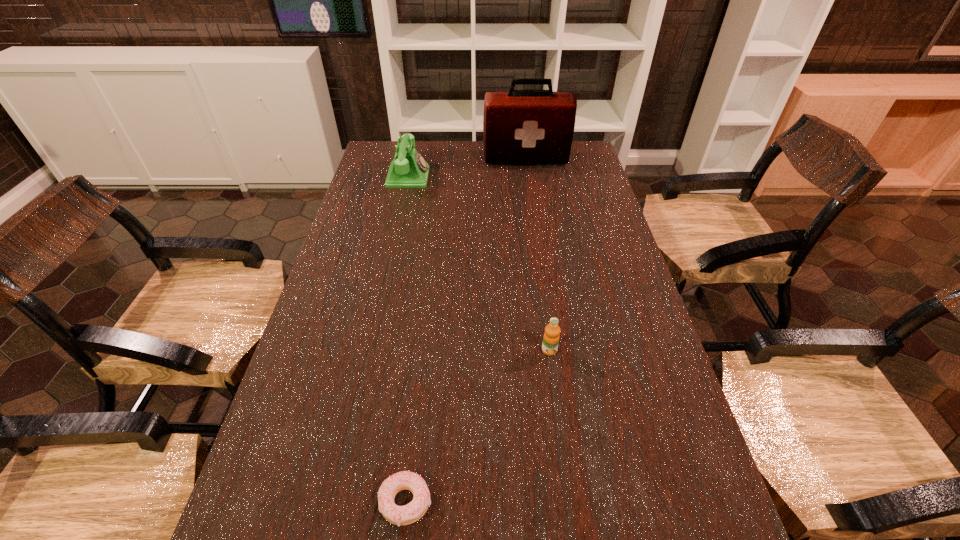
Identify the location of the first aid kit. (519, 126).

Locate an element on the screen. the leftmost object is located at coordinates (408, 169).

This screenshot has height=540, width=960. Find the location of `the second tallest object`. the second tallest object is located at coordinates (408, 169).

Find the location of a particular element. the third tallest object is located at coordinates (551, 336).

The height and width of the screenshot is (540, 960). Identify the location of orange juice. (551, 336).

Find the location of a particular element. the third object from right to left is located at coordinates click(x=404, y=515).

Where is `doughnut`? This screenshot has height=540, width=960. doughnut is located at coordinates (404, 515).

Where is `blank space located on the side of the first aid kit with the cross symbol`? blank space located on the side of the first aid kit with the cross symbol is located at coordinates (530, 187).

The width and height of the screenshot is (960, 540). Identify the location of vacant space located on the dial of the leftmost object. (447, 177).

Identify the location of free space located on the label of the orange juice. (563, 447).